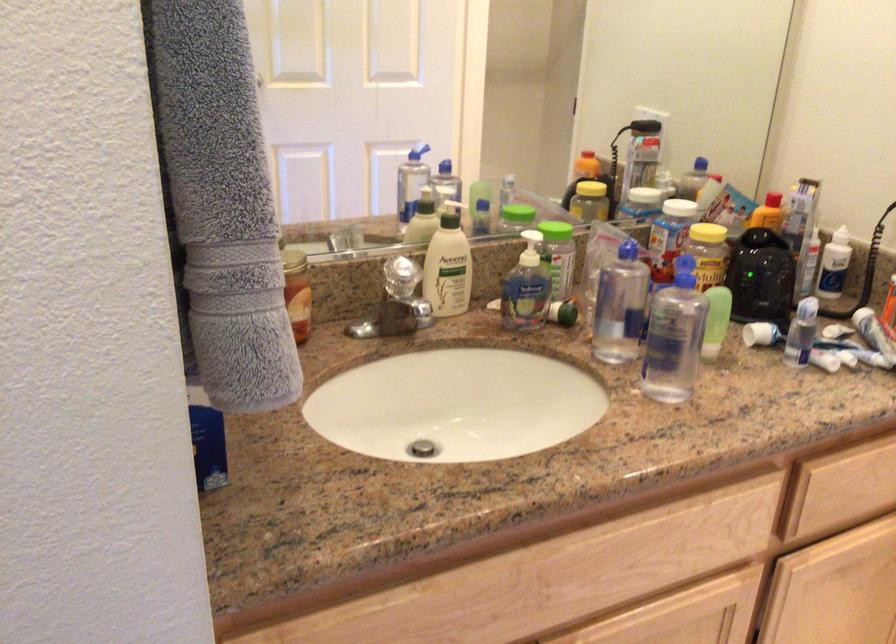
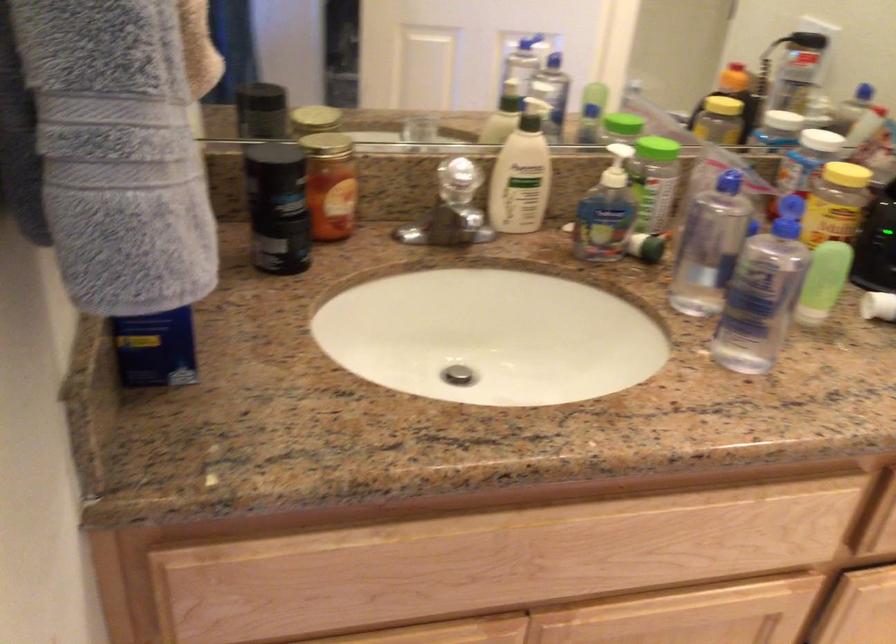
Question: The first image is from the beginning of the video and the second image is from the end. How did the camera likely rotate when shooting the video?

Choices:
 (A) Left
 (B) Right
 (C) Up
 (D) Down

Answer: (A)